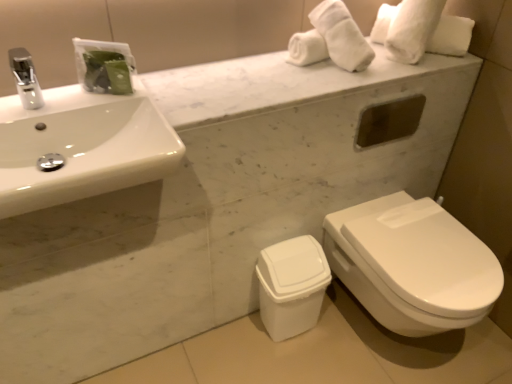
The height and width of the screenshot is (384, 512). Identify the location of vacant area that is situated to the right of white plastic trash can at lower center. (342, 331).